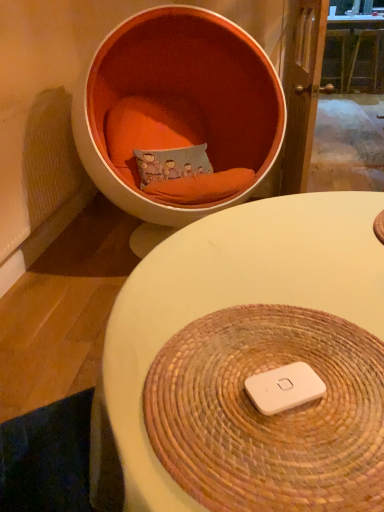
The width and height of the screenshot is (384, 512). What are the coordinates of `vacant space to the right of white matte/ipod at center` in the screenshot? It's located at (345, 377).